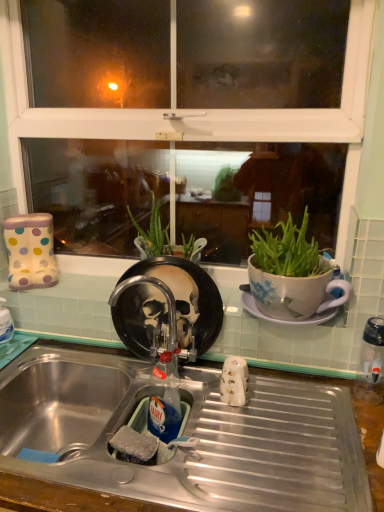
Question: From a real-world perspective, is rubber sponge at sink beneath translucent plastic bottle at sink?

Choices:
 (A) yes
 (B) no

Answer: (A)

Question: Is rubber sponge at sink turned away from translucent plastic bottle at sink?

Choices:
 (A) no
 (B) yes

Answer: (B)

Question: Does rubber sponge at sink appear on the left side of translucent plastic bottle at sink?

Choices:
 (A) no
 (B) yes

Answer: (B)

Question: From the image's perspective, is rubber sponge at sink over translucent plastic bottle at sink?

Choices:
 (A) yes
 (B) no

Answer: (B)

Question: Is rubber sponge at sink surrounding translucent plastic bottle at sink?

Choices:
 (A) no
 (B) yes

Answer: (A)

Question: Is rubber sponge at sink located outside translucent plastic bottle at sink?

Choices:
 (A) yes
 (B) no

Answer: (A)

Question: From a real-world perspective, is metallic faucet at center on clear plastic water bottle at right?

Choices:
 (A) yes
 (B) no

Answer: (A)

Question: Is metallic faucet at center next to clear plastic water bottle at right?

Choices:
 (A) no
 (B) yes

Answer: (A)

Question: Considering the relative positions of metallic faucet at center and clear plastic water bottle at right in the image provided, is metallic faucet at center to the left of clear plastic water bottle at right from the viewer's perspective?

Choices:
 (A) yes
 (B) no

Answer: (A)

Question: Does metallic faucet at center come behind clear plastic water bottle at right?

Choices:
 (A) no
 (B) yes

Answer: (B)

Question: Is clear plastic water bottle at right at the back of metallic faucet at center?

Choices:
 (A) no
 (B) yes

Answer: (A)

Question: Is metallic faucet at center to the right of clear plastic water bottle at right from the viewer's perspective?

Choices:
 (A) yes
 (B) no

Answer: (B)

Question: Is clear plastic water bottle at right directly adjacent to translucent plastic bottle at sink?

Choices:
 (A) no
 (B) yes

Answer: (A)